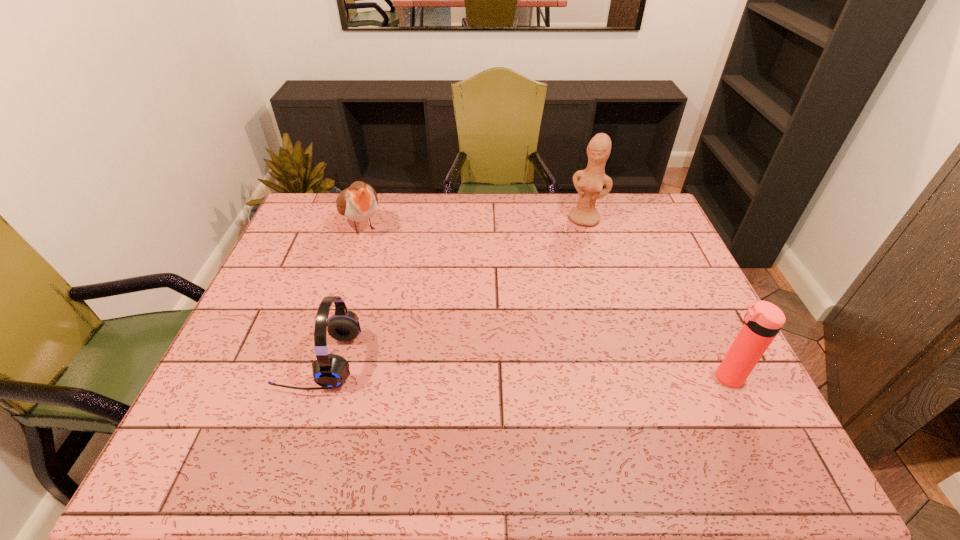
Image resolution: width=960 pixels, height=540 pixels. I want to click on free space between the headset and the bird, so click(341, 293).

I want to click on vacant area between the bird and the tallest object, so click(x=473, y=222).

Where is `vacant space that is in between the thermos bottle and the headset`? This screenshot has height=540, width=960. vacant space that is in between the thermos bottle and the headset is located at coordinates (524, 369).

Image resolution: width=960 pixels, height=540 pixels. I want to click on unoccupied position between the tallest object and the headset, so click(453, 289).

Identify the location of vacant area that lies between the thermos bottle and the tallest object. (657, 298).

Where is `vacant space that's between the bird and the second tallest object`? vacant space that's between the bird and the second tallest object is located at coordinates [544, 301].

The width and height of the screenshot is (960, 540). I want to click on vacant area that lies between the rightmost object and the tallest object, so click(657, 298).

Identify the location of free space between the rightmost object and the tallest object. The height and width of the screenshot is (540, 960). (657, 298).

The height and width of the screenshot is (540, 960). I want to click on vacant space in between the second tallest object and the bird, so click(544, 301).

At what (x,y) coordinates should I click in order to perform the action: click on vacant space that's between the tallest object and the bird. Please return your answer as a coordinate pair (x, y). The height and width of the screenshot is (540, 960). Looking at the image, I should click on (473, 222).